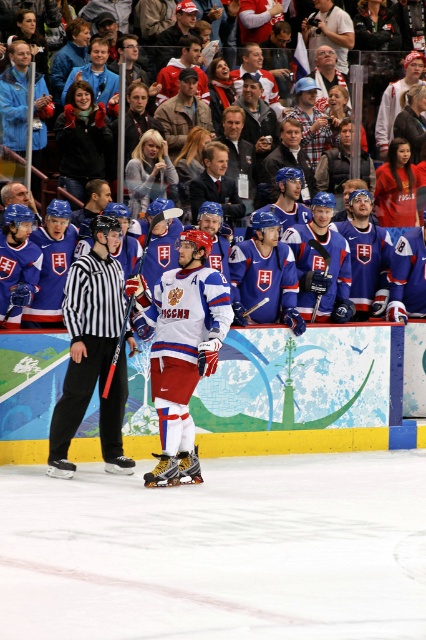
Question: Among these objects, which one is farthest from the camera?

Choices:
 (A) blue jersey at center
 (B) blue jersey fans at center
 (C) black striped shirt at left
 (D) matte blue hockey stick at center

Answer: (B)

Question: Is blue jersey at center smaller than blue jersey fans at center?

Choices:
 (A) yes
 (B) no

Answer: (B)

Question: Is blue jersey at center closer to the viewer compared to white matte hockey stick at center?

Choices:
 (A) yes
 (B) no

Answer: (B)

Question: Which object is farther from the camera taking this photo?

Choices:
 (A) blue jersey fans at center
 (B) black striped shirt at left

Answer: (A)

Question: Can you confirm if blue jersey fans at center is smaller than matte blue hockey stick at center?

Choices:
 (A) no
 (B) yes

Answer: (B)

Question: Among these points, which one is nearest to the camera?

Choices:
 (A) (112, 372)
 (B) (339, 6)
 (C) (282, 408)

Answer: (A)